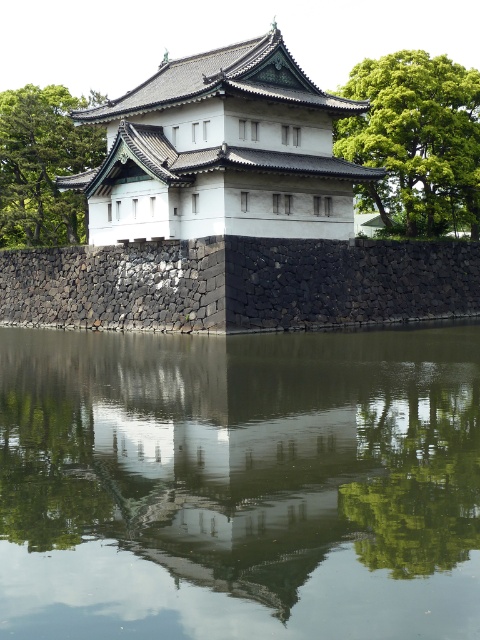
Question: Which point is closer to the camera taking this photo?

Choices:
 (A) pyautogui.click(x=319, y=113)
 (B) pyautogui.click(x=429, y=227)
 (C) pyautogui.click(x=61, y=131)

Answer: (A)

Question: Is black stone wall at lower center smaller than green leafy tree at upper right?

Choices:
 (A) yes
 (B) no

Answer: (A)

Question: In this image, where is green reflective water at center located relative to white stone building at center?

Choices:
 (A) below
 (B) above

Answer: (A)

Question: Considering the real-world distances, which object is farthest from the white stone building at center?

Choices:
 (A) black stone wall at lower center
 (B) green leafy tree at left
 (C) green reflective water at center
 (D) green leafy tree at upper right

Answer: (C)

Question: Which point is closer to the camera taking this photo?

Choices:
 (A) (289, 112)
 (B) (414, 177)

Answer: (A)

Question: Does green reflective water at center have a larger size compared to green leafy tree at upper right?

Choices:
 (A) no
 (B) yes

Answer: (A)